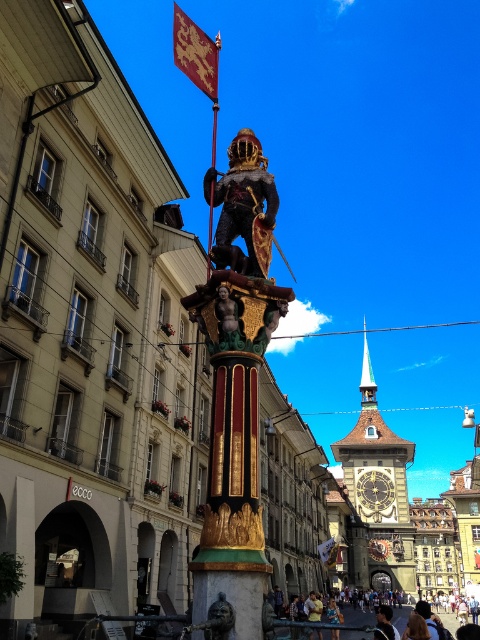
Question: Can you confirm if gold textured flag at upper center is bigger than golden statue at center?

Choices:
 (A) no
 (B) yes

Answer: (B)

Question: Which of the following is the farthest from the observer?

Choices:
 (A) gold textured flag at upper center
 (B) golden statue at center
 (C) gold textured flag at center
 (D) golden textured statue at center

Answer: (C)

Question: In this image, where is yellow fabric person at center located relative to gold textured flag at center?

Choices:
 (A) below
 (B) above

Answer: (B)

Question: Among these objects, which one is nearest to the camera?

Choices:
 (A) shiny dark armor at center
 (B) gold-plated clock tower at center
 (C) golden textured statue at center
 (D) yellow fabric person at center

Answer: (A)

Question: Is shiny dark armor at center further to the viewer compared to golden statue at center?

Choices:
 (A) no
 (B) yes

Answer: (B)

Question: Among these objects, which one is farthest from the camera?

Choices:
 (A) gold metallic clock at center
 (B) yellow fabric person at center
 (C) gold-plated clock tower at center

Answer: (A)